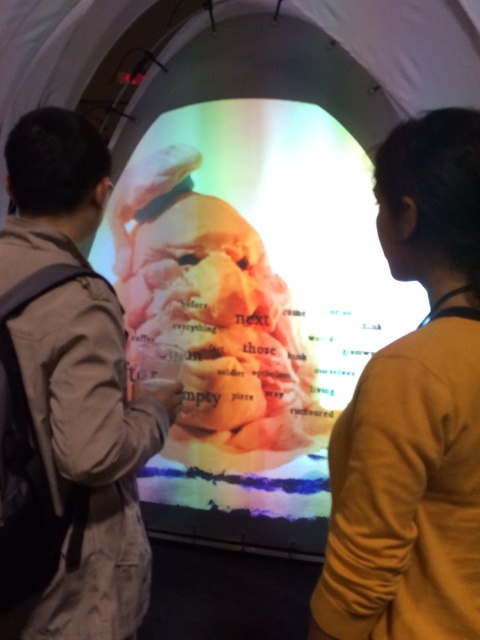
Question: Does translucent plastic face at center appear on the left side of orange sweater at center?

Choices:
 (A) no
 (B) yes

Answer: (B)

Question: Among these objects, which one is farthest from the camera?

Choices:
 (A) translucent plastic face at center
 (B) orange sweater at center

Answer: (A)

Question: Can you confirm if translucent plastic face at center is positioned above khaki cotton jacket at left?

Choices:
 (A) yes
 (B) no

Answer: (A)

Question: Among these points, which one is nearest to the camera?

Choices:
 (A) (172, 458)
 (B) (79, 186)

Answer: (B)

Question: Which object is closer to the camera taking this photo?

Choices:
 (A) khaki cotton jacket at left
 (B) translucent plastic face at center

Answer: (A)

Question: Is translucent plastic face at center wider than orange sweater at center?

Choices:
 (A) no
 (B) yes

Answer: (B)